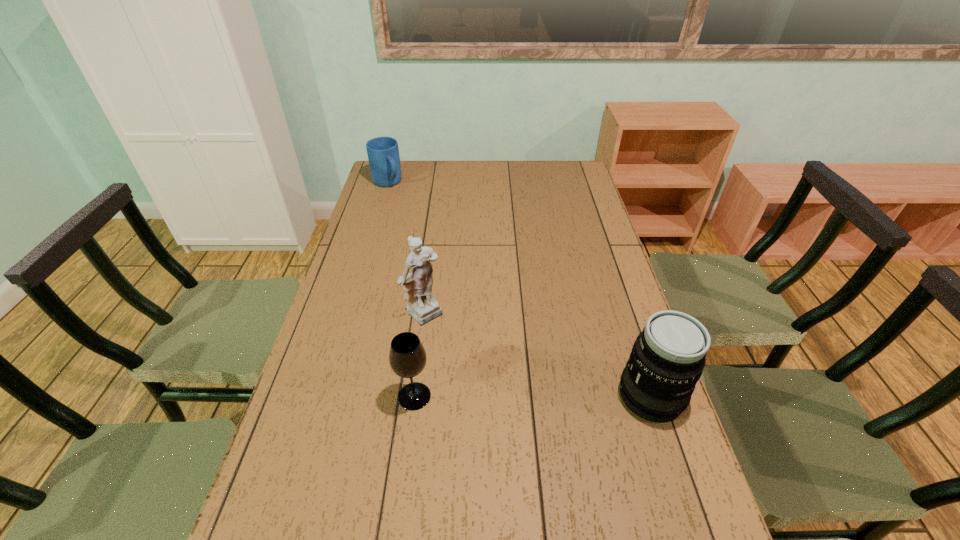
Where is `vacant space on the desktop that is between the third tallest object and the telephoto lens and is positioned on the front-facing side of the figurine`? This screenshot has width=960, height=540. vacant space on the desktop that is between the third tallest object and the telephoto lens and is positioned on the front-facing side of the figurine is located at coordinates (524, 396).

Locate an element on the screen. free spot on the desktop that is between the wineglass and the rightmost object and is positioned on the side of the mug with the handle is located at coordinates (564, 396).